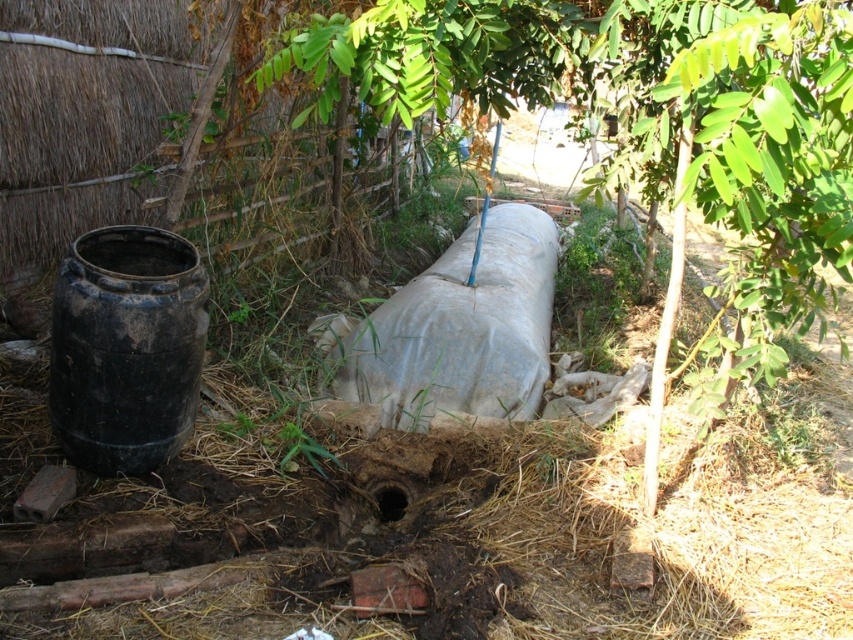
You are a maintenance worker needing to reach both the green leafy tree at center and the gray matte tank at center. Which object is closer to you?

The green leafy tree at center is closer to you since it is only 1.71 meters away from the gray matte tank at center, which is the other object.

Based on the photo, you are standing in the outdoor scene and want to place a new sensor at one of the two points, point (427, 84) or point (512, 218). Which point is closer to you?

Point (427, 84) is closer to the viewer than point (512, 218), so you should place the sensor there.

Consider the image. You are standing in the outdoor area and want to reach the gray matte tank at center. There is a green leafy tree at center blocking your path. Can you walk directly to the tank without going around the tree?

The green leafy tree at center is closer to the viewer than gray matte tank at center, so you cannot walk directly to the tank without going around the tree because the tree is in front of the tank.